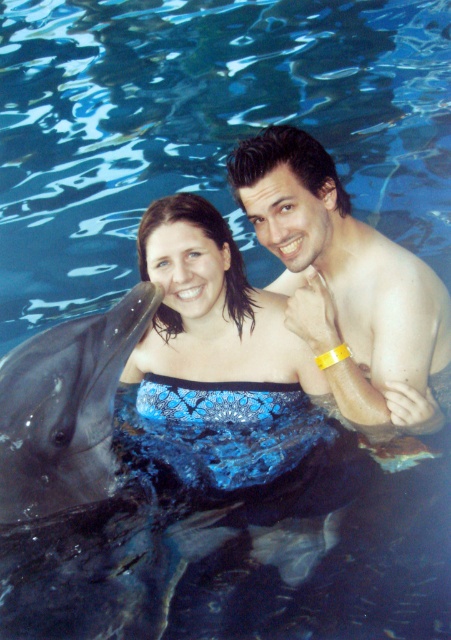
Question: Does smooth skin man at upper right have a greater width compared to gray smooth dolphin at left?

Choices:
 (A) no
 (B) yes

Answer: (B)

Question: Which point is farther to the camera?

Choices:
 (A) (312, 189)
 (B) (78, 432)

Answer: (A)

Question: Is smooth skin man at upper right smaller than gray smooth dolphin at left?

Choices:
 (A) yes
 (B) no

Answer: (B)

Question: Is smooth skin man at upper right to the left of gray smooth dolphin at left from the viewer's perspective?

Choices:
 (A) no
 (B) yes

Answer: (A)

Question: Among these objects, which one is farthest from the camera?

Choices:
 (A) gray smooth dolphin at left
 (B) smooth skin man at upper right

Answer: (B)

Question: Which of the following is the farthest from the observer?

Choices:
 (A) smooth skin man at upper right
 (B) gray smooth dolphin at left

Answer: (A)